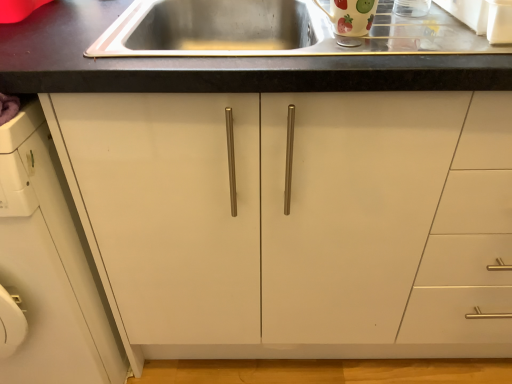
Measure the distance between white matte cabinet at left and camera.

They are 26.36 inches apart.

Describe the element at coordinates (46, 269) in the screenshot. I see `white matte cabinet at left` at that location.

Where is `white matte cabinet at left`? white matte cabinet at left is located at coordinates (46, 269).

What is the approximate height of glossy ceramic mug at upper center?

glossy ceramic mug at upper center is 4.22 inches tall.

In order to click on glossy ceramic mug at upper center in this screenshot , I will do `click(351, 20)`.

What do you see at coordinates (351, 20) in the screenshot? I see `glossy ceramic mug at upper center` at bounding box center [351, 20].

I want to click on white matte cabinet at left, so click(x=46, y=269).

Considering the positions of objects white matte cabinet at left and glossy ceramic mug at upper center in the image provided, who is more to the left, white matte cabinet at left or glossy ceramic mug at upper center?

From the viewer's perspective, white matte cabinet at left appears more on the left side.

Which object is further away from the camera taking this photo, white matte cabinet at left or glossy ceramic mug at upper center?

glossy ceramic mug at upper center is further from the camera.

Which point is more distant from viewer, (77,237) or (327,14)?

The point (77,237) is farther.

From the image's perspective, would you say white matte cabinet at left is positioned over glossy ceramic mug at upper center?

No.

From a real-world perspective, which object rests below the other?

white matte cabinet at left, from a real-world perspective.

Considering the relative sizes of white matte cabinet at left and glossy ceramic mug at upper center in the image provided, is white matte cabinet at left thinner than glossy ceramic mug at upper center?

In fact, white matte cabinet at left might be wider than glossy ceramic mug at upper center.

Is white matte cabinet at left shorter than glossy ceramic mug at upper center?

In fact, white matte cabinet at left may be taller than glossy ceramic mug at upper center.

Is white matte cabinet at left bigger than glossy ceramic mug at upper center?

Indeed, white matte cabinet at left has a larger size compared to glossy ceramic mug at upper center.

Choose the correct answer: Is white matte cabinet at left inside glossy ceramic mug at upper center or outside it?

white matte cabinet at left exists outside the volume of glossy ceramic mug at upper center.

From the picture: Are white matte cabinet at left and glossy ceramic mug at upper center far apart?

No, white matte cabinet at left is in close proximity to glossy ceramic mug at upper center.

Does white matte cabinet at left turn towards glossy ceramic mug at upper center?

No, white matte cabinet at left is not turned towards glossy ceramic mug at upper center.

What's the angular difference between white matte cabinet at left and glossy ceramic mug at upper center's facing directions?

3.81 degrees separate the facing orientations of white matte cabinet at left and glossy ceramic mug at upper center.

This screenshot has width=512, height=384. In order to click on appliance above the white matte cabinet at left (from the image's perspective) in this screenshot , I will do `click(351, 20)`.

Visually, is glossy ceramic mug at upper center positioned to the left or to the right of white matte cabinet at left?

glossy ceramic mug at upper center is positioned on white matte cabinet at left's right side.

Considering their positions, is glossy ceramic mug at upper center located in front of or behind white matte cabinet at left?

glossy ceramic mug at upper center is positioned farther from the viewer than white matte cabinet at left.

Is point (342, 41) farther from viewer compared to point (42, 336)?

That is False.

From the image's perspective, relative to white matte cabinet at left, is glossy ceramic mug at upper center above or below?

glossy ceramic mug at upper center is above white matte cabinet at left.

Based on the photo, from a real-world perspective, is glossy ceramic mug at upper center positioned over white matte cabinet at left based on gravity?

Yes, from a real-world perspective, glossy ceramic mug at upper center is over white matte cabinet at left

Does glossy ceramic mug at upper center have a greater width compared to white matte cabinet at left?

No, glossy ceramic mug at upper center is not wider than white matte cabinet at left.

In terms of height, does glossy ceramic mug at upper center look taller or shorter compared to white matte cabinet at left?

In the image, glossy ceramic mug at upper center appears to be shorter than white matte cabinet at left.

Considering the relative sizes of glossy ceramic mug at upper center and white matte cabinet at left in the image provided, is glossy ceramic mug at upper center smaller than white matte cabinet at left?

Correct, glossy ceramic mug at upper center occupies less space than white matte cabinet at left.

Which is correct: glossy ceramic mug at upper center is inside white matte cabinet at left, or outside of it?

glossy ceramic mug at upper center is outside white matte cabinet at left.

Is glossy ceramic mug at upper center positioned far away from white matte cabinet at left?

No, there isn't a large distance between glossy ceramic mug at upper center and white matte cabinet at left.

Consider the image. Is glossy ceramic mug at upper center positioned with its back to white matte cabinet at left?

No, glossy ceramic mug at upper center's orientation is not away from white matte cabinet at left.

This screenshot has width=512, height=384. I want to click on appliance that appears above the white matte cabinet at left (from a real-world perspective), so click(x=351, y=20).

Locate an element on the screen. cabinetry in front of the glossy ceramic mug at upper center is located at coordinates [46, 269].

Find the location of `appliance that appears behind the white matte cabinet at left`. appliance that appears behind the white matte cabinet at left is located at coordinates (351, 20).